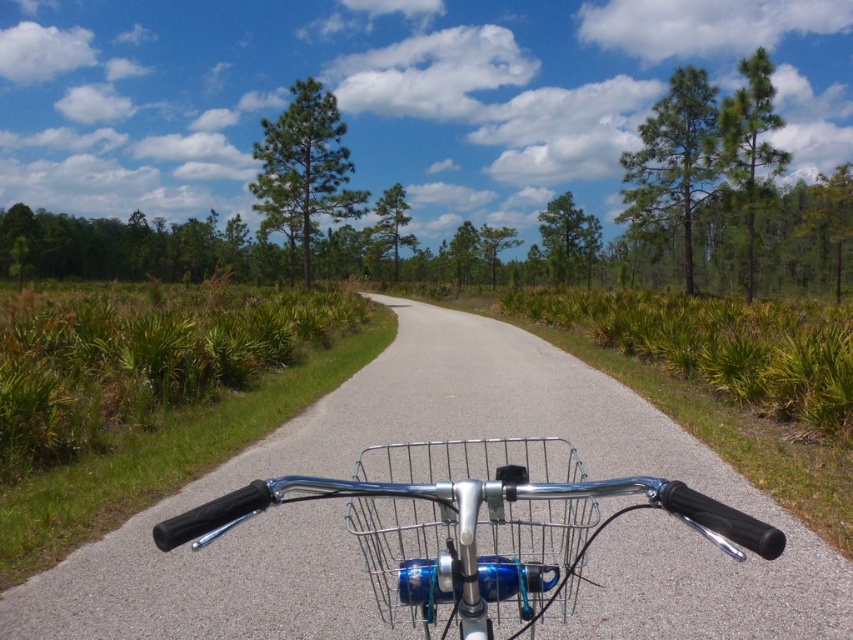
Does metallic asphalt road at center have a greater width compared to silver wire basket at center?

Yes.

Is point (250, 616) closer to viewer compared to point (393, 515)?

Yes, point (250, 616) is closer to viewer.

Where is `metallic asphalt road at center`? metallic asphalt road at center is located at coordinates (474, 403).

Measure the distance between polished chrome bicycle handlebars at center and silver wire basket at center.

A distance of 67.13 centimeters exists between polished chrome bicycle handlebars at center and silver wire basket at center.

Where is `polished chrome bicycle handlebars at center`? polished chrome bicycle handlebars at center is located at coordinates (474, 525).

Identify the location of polished chrome bicycle handlebars at center. The height and width of the screenshot is (640, 853). (x=474, y=525).

Looking at this image, does metallic asphalt road at center appear on the left side of polished chrome bicycle handlebars at center?

In fact, metallic asphalt road at center is to the right of polished chrome bicycle handlebars at center.

Can you confirm if metallic asphalt road at center is smaller than polished chrome bicycle handlebars at center?

No.

Where is `metallic asphalt road at center`? This screenshot has width=853, height=640. metallic asphalt road at center is located at coordinates (474, 403).

Locate an element on the screen. metallic asphalt road at center is located at coordinates (474, 403).